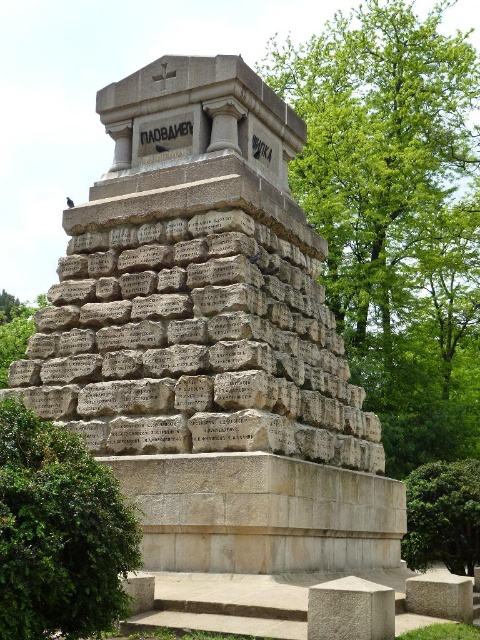
Question: Can you confirm if granite stone monument at center is thinner than green leafy tree at upper right?

Choices:
 (A) yes
 (B) no

Answer: (A)

Question: Which point is farther to the camera?

Choices:
 (A) green leafy tree at upper right
 (B) green leafy bush at lower left
 (C) granite stone monument at center
 (D) green leafy tree at lower right

Answer: (A)

Question: Does green leafy bush at lower left have a smaller size compared to green leafy tree at lower right?

Choices:
 (A) no
 (B) yes

Answer: (B)

Question: Does granite stone monument at center appear over green leafy tree at lower right?

Choices:
 (A) no
 (B) yes

Answer: (B)

Question: Considering the real-world distances, which object is farthest from the green leafy tree at upper right?

Choices:
 (A) granite stone monument at center
 (B) green leafy bush at lower left

Answer: (B)

Question: Considering the real-world distances, which object is farthest from the green leafy bush at lower left?

Choices:
 (A) green leafy tree at lower right
 (B) granite stone monument at center
 (C) green leafy tree at upper right

Answer: (C)